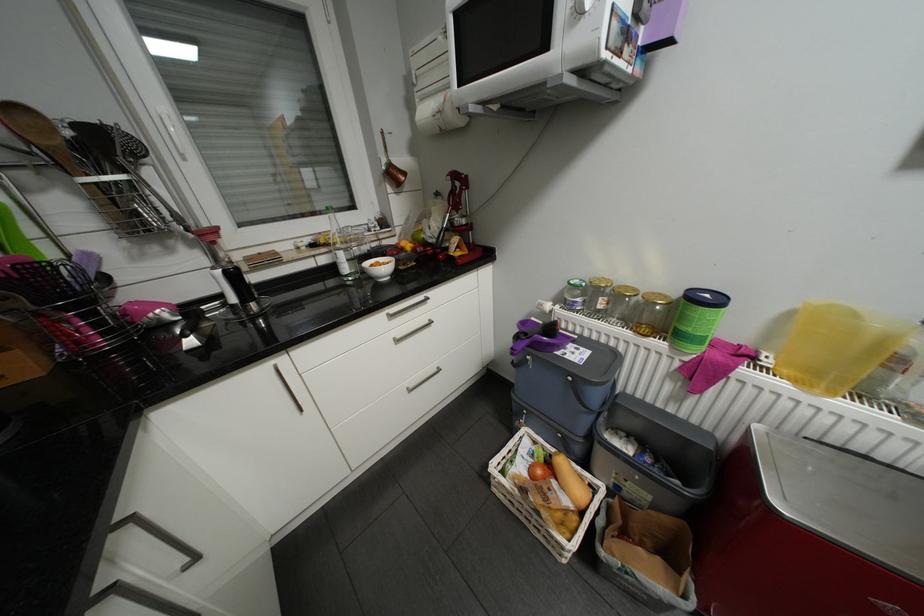
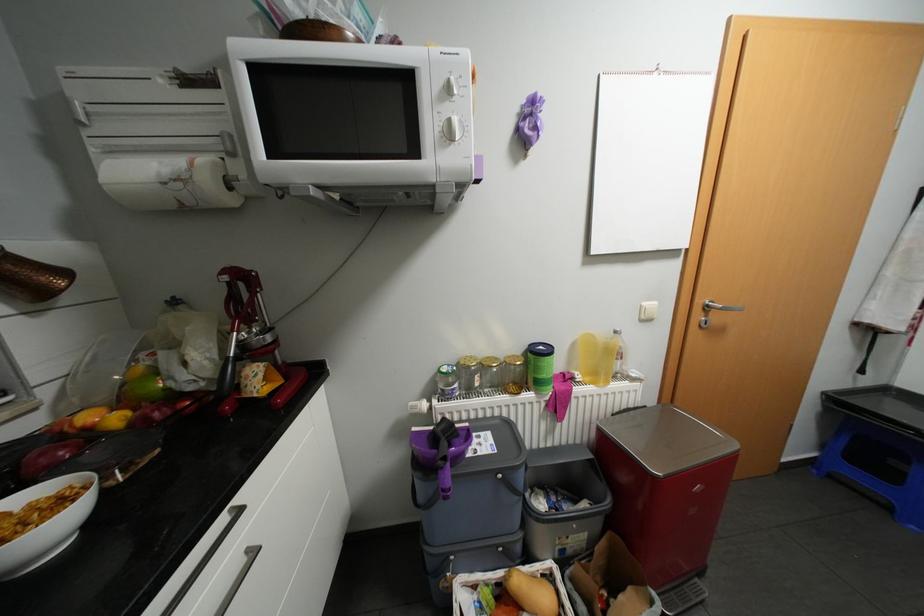
In the second image, find the point that corresponds to the point at 586,299 in the first image.

(464, 384)